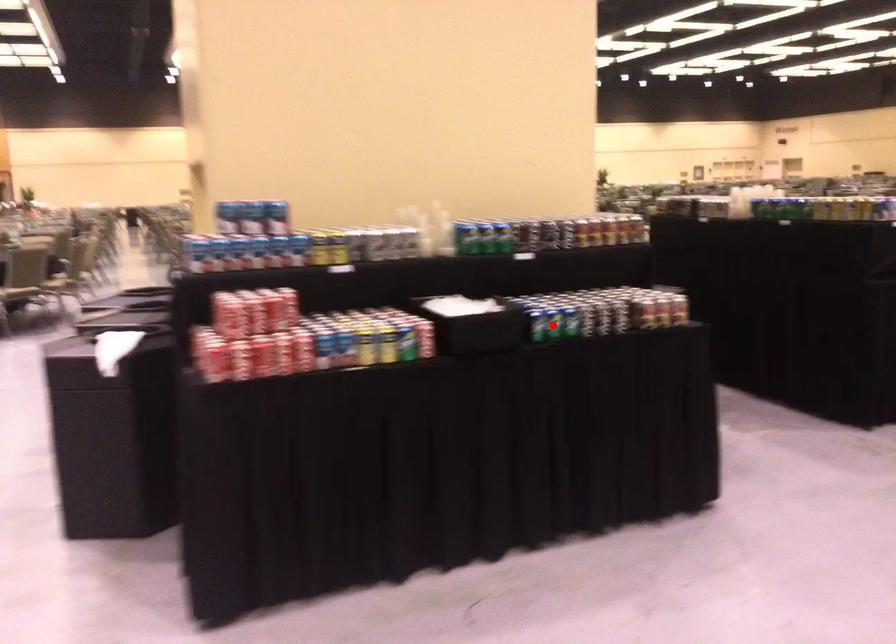
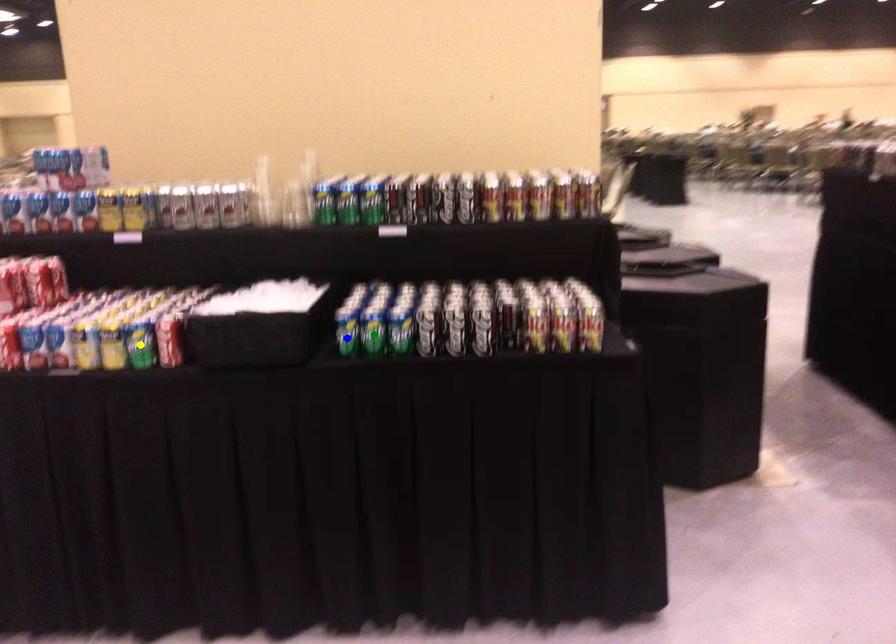
Question: I am providing you with two images of the same scene from different viewpoints. A red point is marked on the first image. You are given multiple points on the second image. Which spot in image 2 lines up with the point in image 1?

Choices:
 (A) yellow point
 (B) green point
 (C) blue point

Answer: (B)